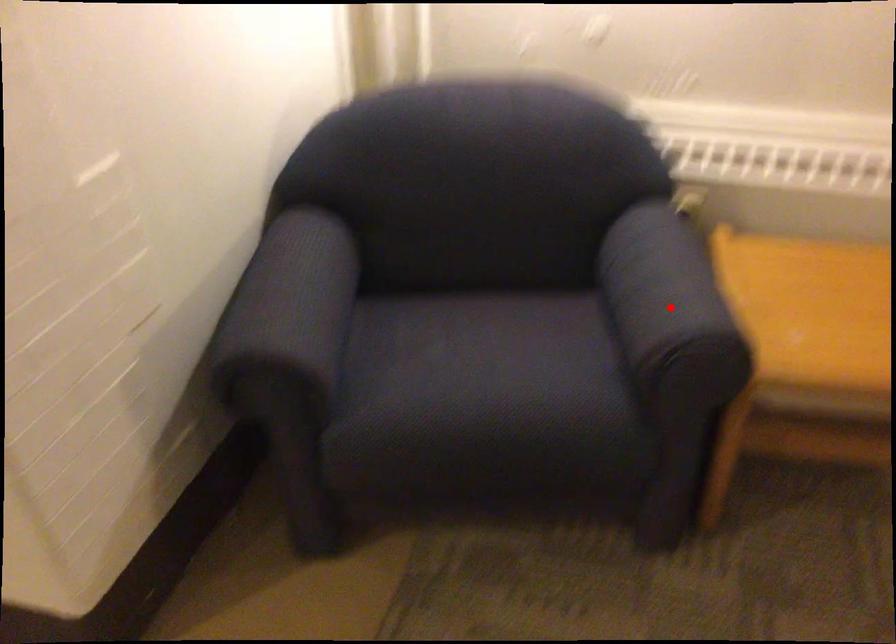
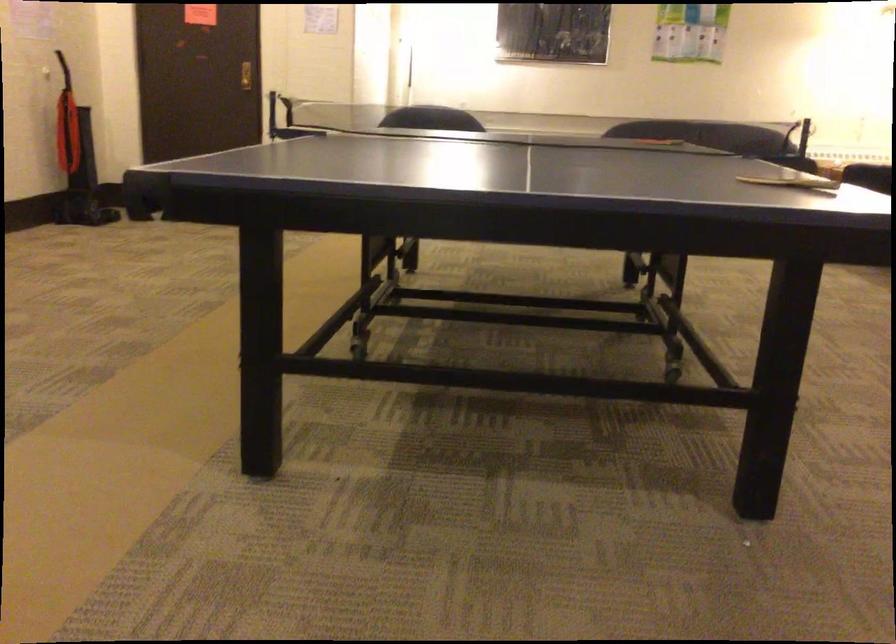
Question: I am providing you with two images of the same scene from different viewpoints. A red point is marked on the first image. At the location where the point appears in image 1, is it still visible in image 2?

Choices:
 (A) Yes
 (B) No

Answer: (B)